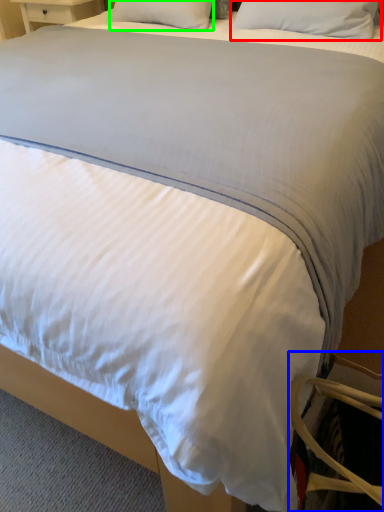
Question: Considering the real-world distances, which object is farthest from pillow (highlighted by a red box)? swivel chair (highlighted by a blue box) or pillow (highlighted by a green box)?

Choices:
 (A) swivel chair
 (B) pillow

Answer: (A)